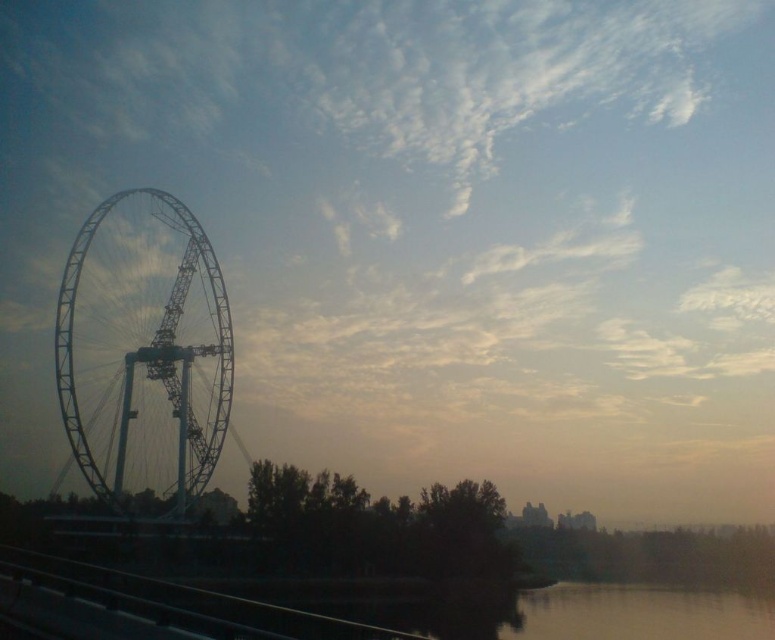
Question: Is white metallic ferris wheel at left bigger than metallic ferris wheel at left?

Choices:
 (A) yes
 (B) no

Answer: (A)

Question: Which point is closer to the camera taking this photo?

Choices:
 (A) (122, 237)
 (B) (711, 627)

Answer: (A)

Question: Which point appears closest to the camera in this image?

Choices:
 (A) (102, 595)
 (B) (131, 308)

Answer: (A)

Question: In this image, where is white metallic ferris wheel at left located relative to metallic ferris wheel at left?

Choices:
 (A) below
 (B) above

Answer: (A)

Question: Does white metallic ferris wheel at left appear over metallic ferris wheel at left?

Choices:
 (A) yes
 (B) no

Answer: (B)

Question: Which object is farther from the camera taking this photo?

Choices:
 (A) metallic ferris wheel at left
 (B) white metallic ferris wheel at left

Answer: (A)